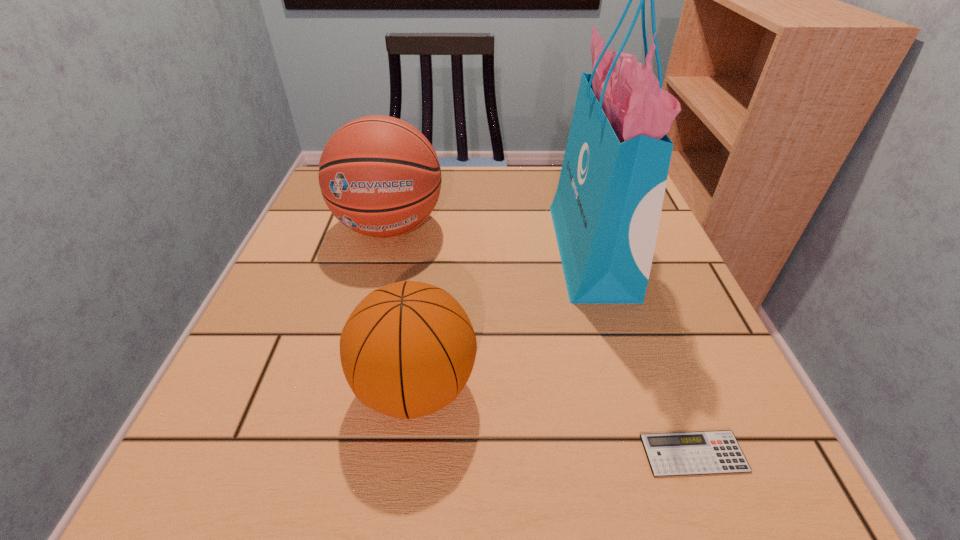
The height and width of the screenshot is (540, 960). Find the location of `vacant area between the shortest object and the shorter basketball`. vacant area between the shortest object and the shorter basketball is located at coordinates (555, 420).

Where is `unoccupied position between the shopping bag and the second tallest object`? The image size is (960, 540). unoccupied position between the shopping bag and the second tallest object is located at coordinates (491, 239).

Locate an element on the screen. unoccupied area between the shortest object and the shopping bag is located at coordinates (642, 352).

The width and height of the screenshot is (960, 540). What are the coordinates of `vacant space that is in between the farther basketball and the shopping bag` in the screenshot? It's located at (491, 239).

Where is `empty space that is in between the taller basketball and the tallest object`? This screenshot has width=960, height=540. empty space that is in between the taller basketball and the tallest object is located at coordinates click(x=491, y=239).

What are the coordinates of `object that is the closest to the shopping bag` in the screenshot? It's located at (407, 350).

At what (x,y) coordinates should I click in order to perform the action: click on object that is the closest one to the tallest object. Please return your answer as a coordinate pair (x, y). Looking at the image, I should click on (407, 350).

Where is `free space that satisfies the following two spatial constraints: 1. on the front side of the second shortest object; 2. on the left side of the shortest object`? This screenshot has width=960, height=540. free space that satisfies the following two spatial constraints: 1. on the front side of the second shortest object; 2. on the left side of the shortest object is located at coordinates (407, 454).

Locate an element on the screen. The height and width of the screenshot is (540, 960). free space that satisfies the following two spatial constraints: 1. on the back side of the nearer basketball; 2. on the right side of the shopping bag is located at coordinates click(x=433, y=251).

Find the location of a particular element. vacant region that satisfies the following two spatial constraints: 1. on the logo side of the calculator; 2. on the left side of the third shortest object is located at coordinates (331, 454).